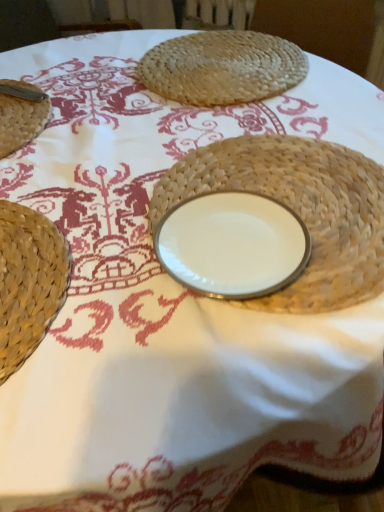
Question: Should I look upward or downward to see white porcelain plate at center?

Choices:
 (A) up
 (B) down

Answer: (A)

Question: Is woven straw placemat at upper center wider than white porcelain plate at center?

Choices:
 (A) no
 (B) yes

Answer: (B)

Question: Is woven straw placemat at upper center closer to the viewer compared to white porcelain plate at center?

Choices:
 (A) no
 (B) yes

Answer: (A)

Question: Are woven straw placemat at upper center and white porcelain plate at center making contact?

Choices:
 (A) yes
 (B) no

Answer: (B)

Question: Considering the relative sizes of woven straw placemat at upper center and white porcelain plate at center in the image provided, is woven straw placemat at upper center thinner than white porcelain plate at center?

Choices:
 (A) no
 (B) yes

Answer: (A)

Question: From a real-world perspective, is woven straw placemat at upper center positioned under white porcelain plate at center based on gravity?

Choices:
 (A) no
 (B) yes

Answer: (A)

Question: Is woven straw placemat at upper center not within white porcelain plate at center?

Choices:
 (A) yes
 (B) no

Answer: (A)

Question: Would you say white porcelain plate at center is outside woven straw placemat at upper center?

Choices:
 (A) yes
 (B) no

Answer: (A)

Question: Considering the relative sizes of white porcelain plate at center and woven straw placemat at upper center in the image provided, is white porcelain plate at center bigger than woven straw placemat at upper center?

Choices:
 (A) no
 (B) yes

Answer: (A)

Question: Can you confirm if white porcelain plate at center is smaller than woven straw placemat at upper center?

Choices:
 (A) no
 (B) yes

Answer: (B)

Question: Is white porcelain plate at center facing towards woven straw placemat at upper center?

Choices:
 (A) yes
 (B) no

Answer: (B)

Question: Can you see white porcelain plate at center touching woven straw placemat at upper center?

Choices:
 (A) yes
 (B) no

Answer: (B)

Question: From the image's perspective, is white porcelain plate at center on top of woven straw placemat at upper center?

Choices:
 (A) yes
 (B) no

Answer: (B)

Question: Considering the relative sizes of woven straw plate at center and white porcelain plate at center in the image provided, is woven straw plate at center shorter than white porcelain plate at center?

Choices:
 (A) no
 (B) yes

Answer: (A)